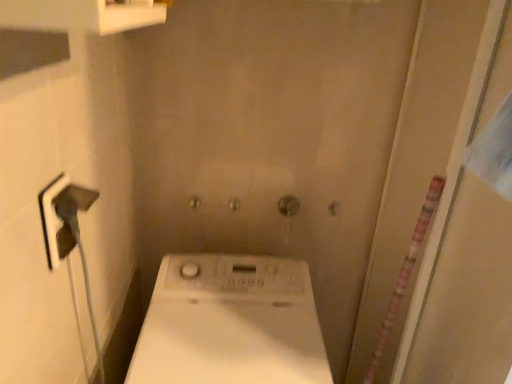
Where is `transparent plastic screen door at right`? This screenshot has height=384, width=512. transparent plastic screen door at right is located at coordinates (467, 250).

The height and width of the screenshot is (384, 512). What do you see at coordinates (467, 250) in the screenshot?
I see `transparent plastic screen door at right` at bounding box center [467, 250].

Locate an element on the screen. white matte washing machine at center is located at coordinates pyautogui.click(x=230, y=324).

Measure the distance between white matte washing machine at center and camera.

They are 30.48 inches apart.

In order to face white matte washing machine at center, should I rotate leftwards or rightwards?

To face it directly, rotate left by 2.502 degrees.

The image size is (512, 384). What do you see at coordinates (230, 324) in the screenshot?
I see `white matte washing machine at center` at bounding box center [230, 324].

Identify the location of transparent plastic screen door at right. (467, 250).

From the picture: Which object is positioned more to the left, white matte washing machine at center or transparent plastic screen door at right?

From the viewer's perspective, white matte washing machine at center appears more on the left side.

Is the position of white matte washing machine at center less distant than that of transparent plastic screen door at right?

No, white matte washing machine at center is behind transparent plastic screen door at right.

Does point (202, 339) appear closer or farther from the camera than point (499, 39)?

Point (202, 339).

From the image's perspective, which is below, white matte washing machine at center or transparent plastic screen door at right?

white matte washing machine at center appears lower in the image.

From a real-world perspective, does white matte washing machine at center sit lower than transparent plastic screen door at right?

Yes, from a real-world perspective, white matte washing machine at center is below transparent plastic screen door at right.

Considering the sizes of objects white matte washing machine at center and transparent plastic screen door at right in the image provided, who is thinner, white matte washing machine at center or transparent plastic screen door at right?

transparent plastic screen door at right.

Considering the sizes of objects white matte washing machine at center and transparent plastic screen door at right in the image provided, who is shorter, white matte washing machine at center or transparent plastic screen door at right?

white matte washing machine at center.

Between white matte washing machine at center and transparent plastic screen door at right, which one has smaller size?

white matte washing machine at center.

Is white matte washing machine at center not inside transparent plastic screen door at right?

Indeed, white matte washing machine at center is completely outside transparent plastic screen door at right.

Is white matte washing machine at center placed right next to transparent plastic screen door at right?

No, white matte washing machine at center is not with transparent plastic screen door at right.

Is white matte washing machine at center looking in the opposite direction of transparent plastic screen door at right?

No.

Locate an element on the screen. The width and height of the screenshot is (512, 384). screen door above the white matte washing machine at center (from a real-world perspective) is located at coordinates (467, 250).

Which is more to the right, transparent plastic screen door at right or white matte washing machine at center?

transparent plastic screen door at right.

Between transparent plastic screen door at right and white matte washing machine at center, which one is positioned in front?

transparent plastic screen door at right is more forward.

Is point (490, 57) closer to camera compared to point (280, 359)?

Yes, point (490, 57) is closer to viewer.

From the image's perspective, is transparent plastic screen door at right positioned above or below white matte washing machine at center?

From the image's perspective, transparent plastic screen door at right appears above white matte washing machine at center.

From a real-world perspective, is transparent plastic screen door at right above or below white matte washing machine at center?

transparent plastic screen door at right is above white matte washing machine at center.

In terms of width, does transparent plastic screen door at right look wider or thinner when compared to white matte washing machine at center?

In the image, transparent plastic screen door at right appears to be more narrow than white matte washing machine at center.

Consider the image. Is transparent plastic screen door at right shorter than white matte washing machine at center?

In fact, transparent plastic screen door at right may be taller than white matte washing machine at center.

Consider the image. Considering the sizes of objects transparent plastic screen door at right and white matte washing machine at center in the image provided, who is smaller, transparent plastic screen door at right or white matte washing machine at center?

With smaller size is white matte washing machine at center.

Is transparent plastic screen door at right inside the boundaries of white matte washing machine at center, or outside?

transparent plastic screen door at right lies outside white matte washing machine at center.

Is transparent plastic screen door at right in contact with white matte washing machine at center?

No, transparent plastic screen door at right is not beside white matte washing machine at center.

Is transparent plastic screen door at right aimed at white matte washing machine at center?

Yes, transparent plastic screen door at right is facing white matte washing machine at center.

What's the angular difference between transparent plastic screen door at right and white matte washing machine at center's facing directions?

There is a 89.5-degree angle between the facing directions of transparent plastic screen door at right and white matte washing machine at center.

You are a GUI agent. You are given a task and a screenshot of the screen. Output one action in this format:
    pyautogui.click(x=<x>, y=<y>)
    Task: Click on the washing machine below the transparent plastic screen door at right (from the image's perspective)
    The height and width of the screenshot is (384, 512).
    Given the screenshot: What is the action you would take?
    pyautogui.click(x=230, y=324)

This screenshot has width=512, height=384. I want to click on washing machine behind the transparent plastic screen door at right, so click(x=230, y=324).

Find the location of a particular element. The width and height of the screenshot is (512, 384). screen door above the white matte washing machine at center (from the image's perspective) is located at coordinates (467, 250).